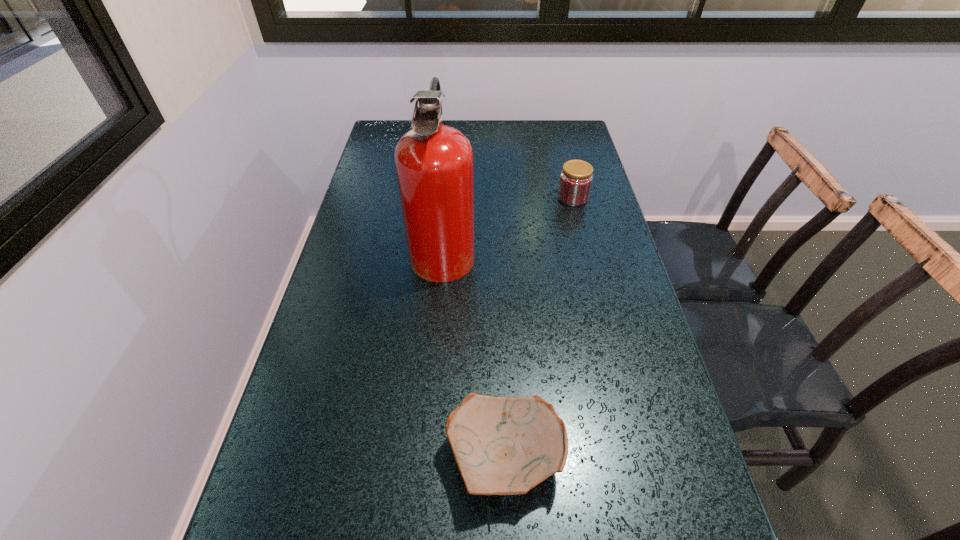
Locate an element on the screen. the tallest object is located at coordinates (434, 162).

You are a GUI agent. You are given a task and a screenshot of the screen. Output one action in this format:
    pyautogui.click(x=<x>, y=<y>)
    Task: Click on the second farthest object
    
    Given the screenshot: What is the action you would take?
    pyautogui.click(x=434, y=162)

What are the coordinates of `the second shortest object` in the screenshot? It's located at (575, 181).

This screenshot has height=540, width=960. What are the coordinates of `the farthest object` in the screenshot? It's located at (575, 181).

Find the location of `the nearest object`. the nearest object is located at coordinates (502, 445).

Where is `pottery`? The height and width of the screenshot is (540, 960). pottery is located at coordinates (502, 445).

Locate an element on the screen. vacant space situated with the handle and nozzle on the tallest object is located at coordinates (612, 249).

Identify the location of vacant point located 0.140m on the front of the jam. (583, 238).

What are the coordinates of `free point located 0.120m on the left of the shortest object` in the screenshot? It's located at (382, 457).

Locate an element on the screen. Image resolution: width=960 pixels, height=540 pixels. object located in the right edge section of the desktop is located at coordinates (575, 181).